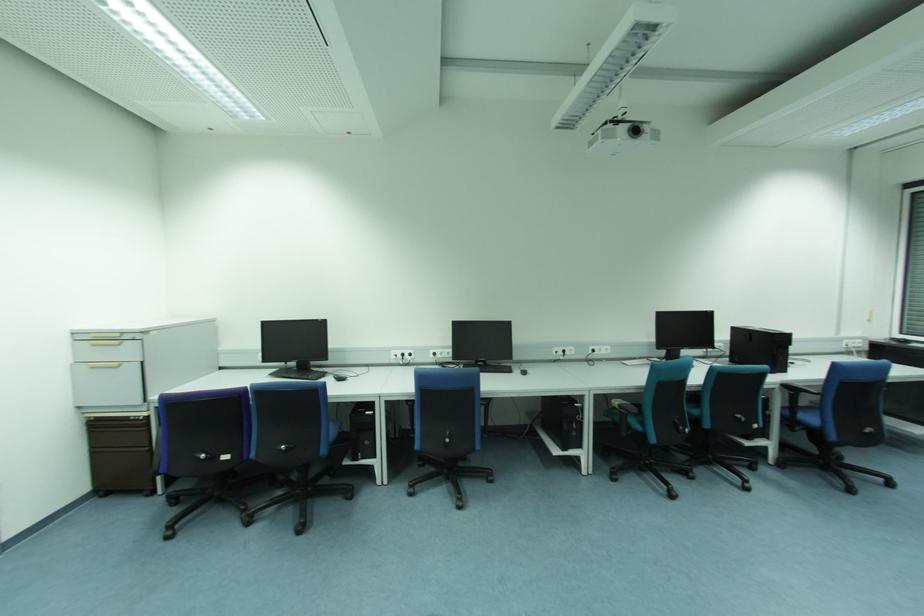
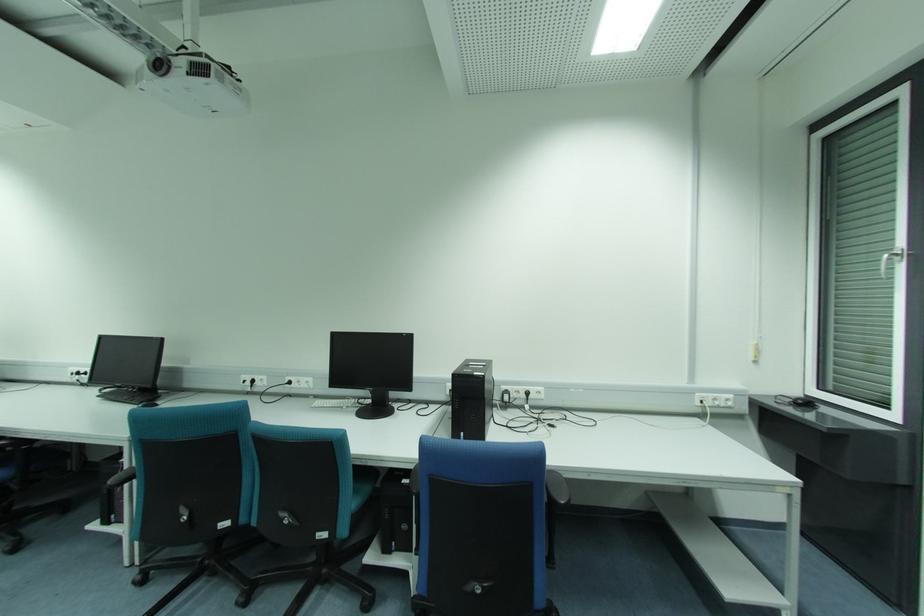
Find the pixel in the second image that matches point 594,351 in the first image.

(289, 383)